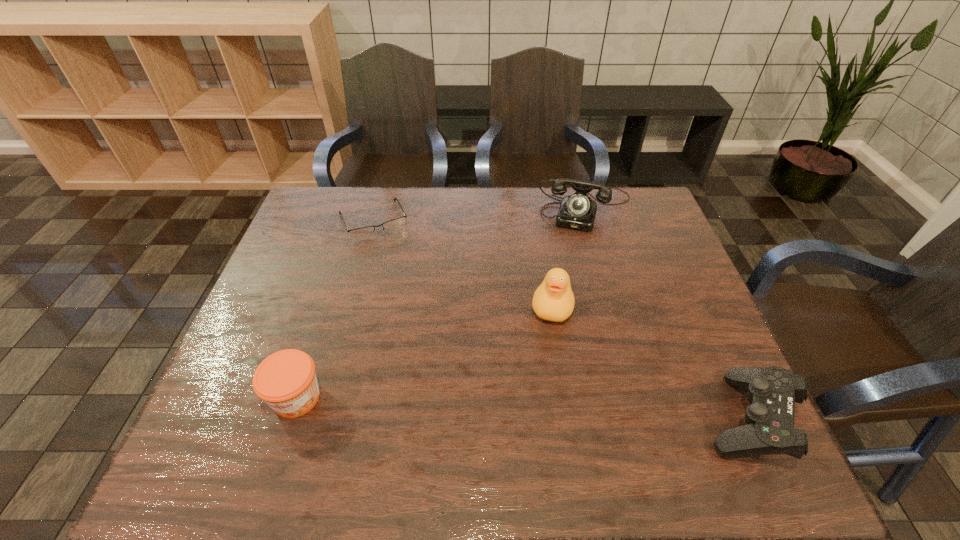
Identify the location of vacant spot on the desktop that is between the jam and the control and is positioned on the front-facing side of the spectacles. (457, 405).

You are a GUI agent. You are given a task and a screenshot of the screen. Output one action in this format:
    pyautogui.click(x=<x>, y=<y>)
    Task: Click on the vacant space on the desktop that is between the jam and the control and is positioned on the face of the tallest object
    The width and height of the screenshot is (960, 540).
    Given the screenshot: What is the action you would take?
    pyautogui.click(x=532, y=408)

Identify the location of vacant spot on the desktop that is between the jam and the control and is positioned on the front-facing side of the telephone. The width and height of the screenshot is (960, 540). coord(540,409).